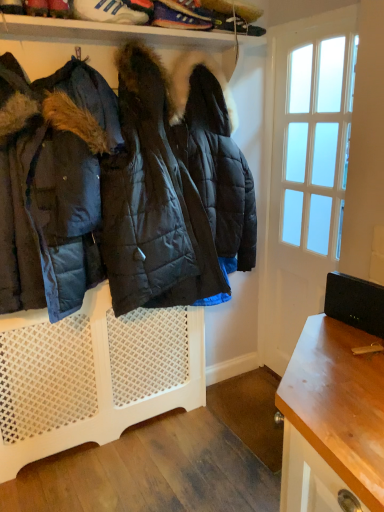
Question: From the image's perspective, would you say blue suede sneakers at upper center, which appears as the second footwear when viewed from the left, is shown under matte black jacket at left?

Choices:
 (A) no
 (B) yes

Answer: (A)

Question: Is matte black jacket at left inside blue suede sneakers at upper center, the 1th footwear when ordered from right to left?

Choices:
 (A) yes
 (B) no

Answer: (B)

Question: Can you confirm if blue suede sneakers at upper center, the 1th footwear when ordered from right to left, is wider than matte black jacket at left?

Choices:
 (A) yes
 (B) no

Answer: (B)

Question: Is blue suede sneakers at upper center, which appears as the second footwear when viewed from the left, turned away from matte black jacket at left?

Choices:
 (A) no
 (B) yes

Answer: (A)

Question: Is blue suede sneakers at upper center, the 1th footwear when ordered from right to left, oriented towards matte black jacket at left?

Choices:
 (A) no
 (B) yes

Answer: (A)

Question: Is the depth of blue suede sneakers at upper center, which appears as the second footwear when viewed from the left, greater than that of matte black jacket at left?

Choices:
 (A) no
 (B) yes

Answer: (B)

Question: From the image's perspective, does white mesh radiator at center appear higher than blue suede sneakers at upper center, the 1th footwear when ordered from right to left?

Choices:
 (A) no
 (B) yes

Answer: (A)

Question: Is white mesh radiator at center not inside blue suede sneakers at upper center, which appears as the second footwear when viewed from the left?

Choices:
 (A) no
 (B) yes

Answer: (B)

Question: From a real-world perspective, does white mesh radiator at center stand above blue suede sneakers at upper center, which appears as the second footwear when viewed from the left?

Choices:
 (A) no
 (B) yes

Answer: (A)

Question: Can you confirm if white mesh radiator at center is shorter than blue suede sneakers at upper center, the 1th footwear when ordered from right to left?

Choices:
 (A) no
 (B) yes

Answer: (A)

Question: Is white mesh radiator at center to the left of blue suede sneakers at upper center, the 1th footwear when ordered from right to left, from the viewer's perspective?

Choices:
 (A) no
 (B) yes

Answer: (B)

Question: Is white mesh radiator at center behind blue suede sneakers at upper center, which appears as the second footwear when viewed from the left?

Choices:
 (A) yes
 (B) no

Answer: (B)

Question: Considering the relative positions of white mesh radiator at center and shiny leather sneaker at upper left in the image provided, is white mesh radiator at center to the right of shiny leather sneaker at upper left from the viewer's perspective?

Choices:
 (A) yes
 (B) no

Answer: (A)